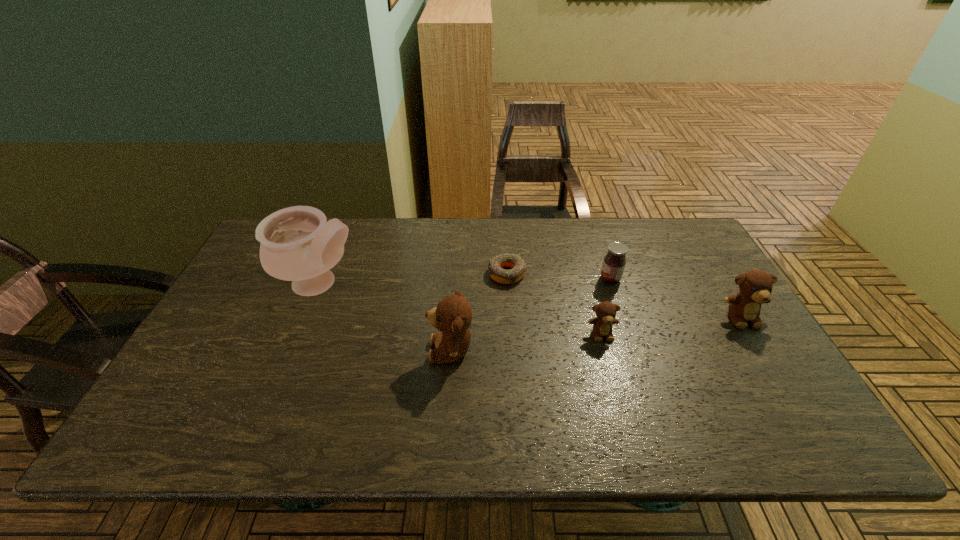
All teddy bears are currently evenly spaced. To continue this pattern, where would you add another teddy bear on the left? Please point out a vacant spot. Please provide its 2D coordinates. Your answer should be formatted as a tuple, i.e. [(x, y)], where the tuple contains the x and y coordinates of a point satisfying the conditions above.

[(288, 369)]